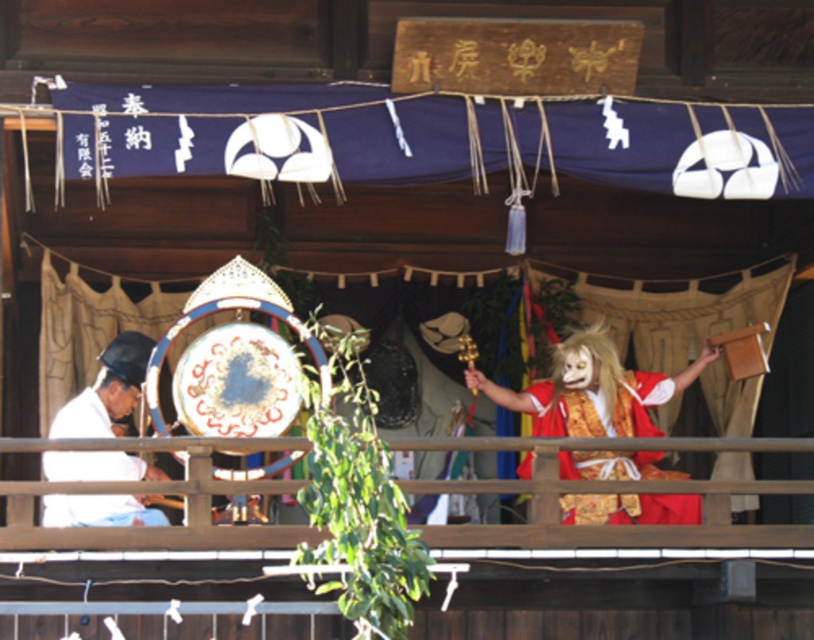
Question: Can you confirm if red satin kimono at center is positioned to the left of white matte/soft fabric at left?

Choices:
 (A) yes
 (B) no

Answer: (B)

Question: Which object appears farthest from the camera in this image?

Choices:
 (A) red satin kimono at center
 (B) white matte/soft fabric at left

Answer: (A)

Question: Which of the following is the closest to the observer?

Choices:
 (A) white matte/soft fabric at left
 (B) red satin kimono at center

Answer: (A)

Question: Is red satin kimono at center to the left of white matte/soft fabric at left from the viewer's perspective?

Choices:
 (A) yes
 (B) no

Answer: (B)

Question: Which point is closer to the camera taking this photo?

Choices:
 (A) (53, 456)
 (B) (567, 432)

Answer: (A)

Question: Is red satin kimono at center to the right of white matte/soft fabric at left from the viewer's perspective?

Choices:
 (A) yes
 (B) no

Answer: (A)